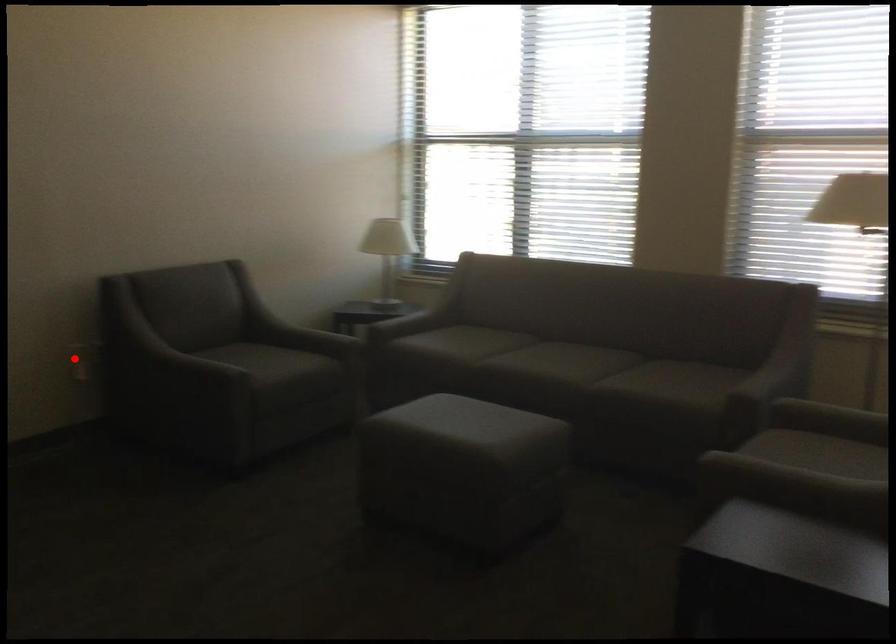
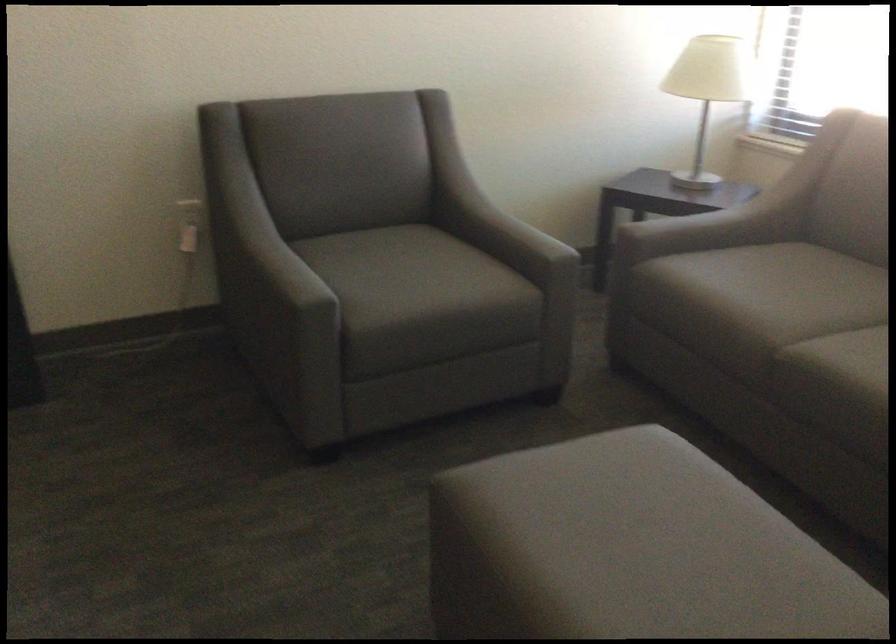
Question: I am providing you with two images of the same scene from different viewpoints. A red point is shown in image1. For the corresponding object point in image2, is it positioned nearer or farther from the camera?

Choices:
 (A) Nearer
 (B) Farther

Answer: (A)